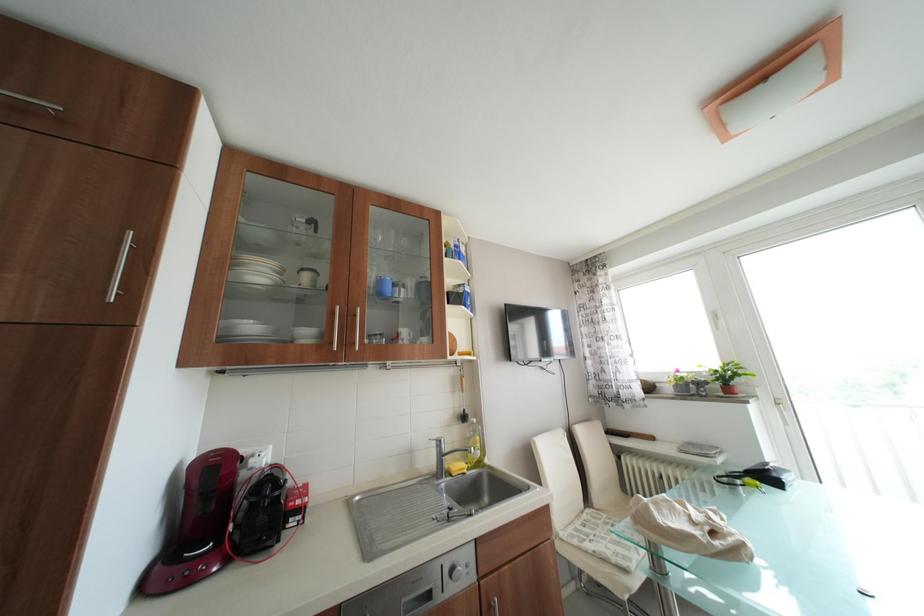
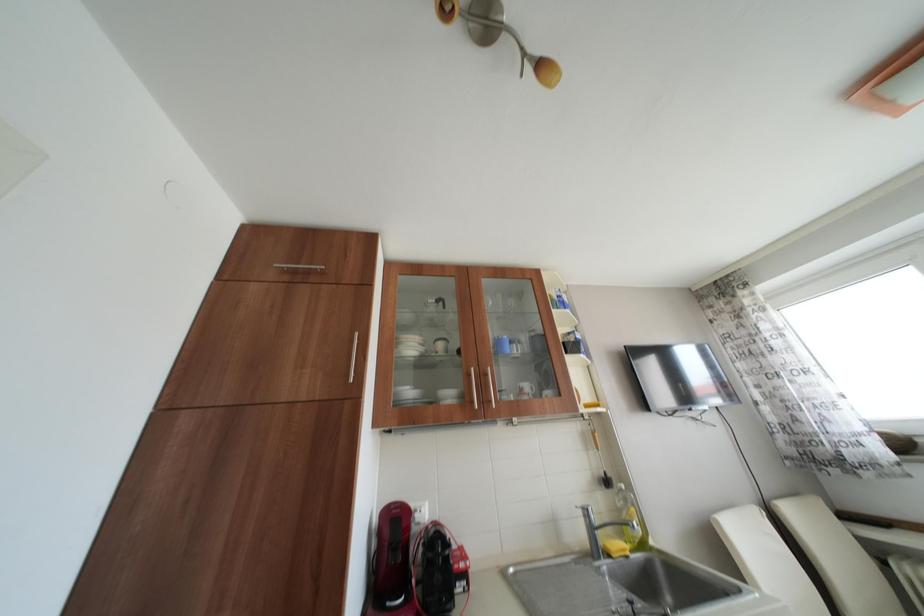
Question: The images are taken continuously from a first-person perspective. In which direction is your viewpoint rotating?

Choices:
 (A) Left
 (B) Right
 (C) Up
 (D) Down

Answer: (A)